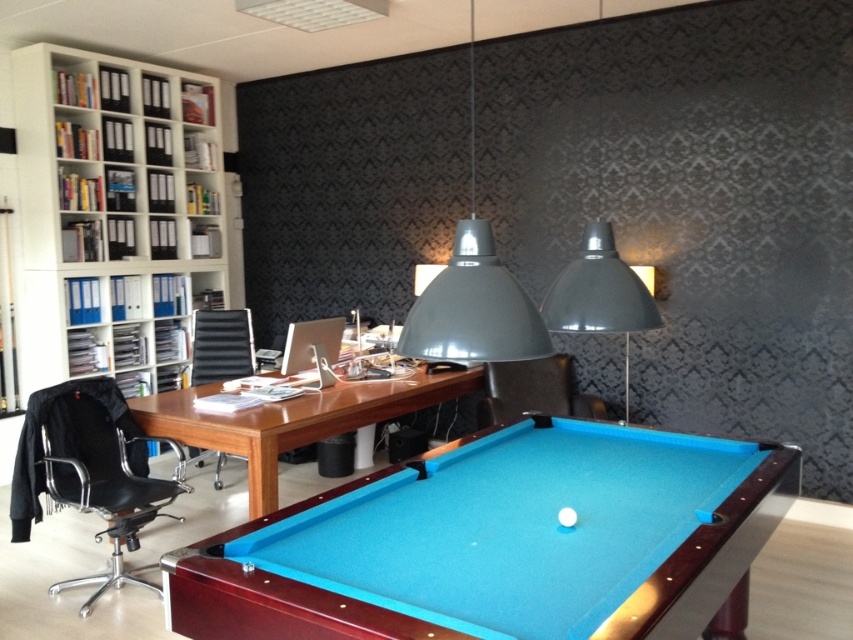
You are standing in the modern office space and want to move from the pool table to the shelving unit. Which point, point (x=86, y=72) or point (x=548, y=298), is closer to you as you move towards the shelving unit?

Point (x=86, y=72) is closer to you because it is further to the viewer than point (x=548, y=298), meaning it is nearer in your line of sight as you move towards the shelving unit.

You are organizing the office and need to place a new item between the white plastic bookcase at upper left and the matte gray lampshade at upper center. Is there enough space to place it there?

The white plastic bookcase at upper left is to the left of the matte gray lampshade at upper center, so there is space between them to place the new item.